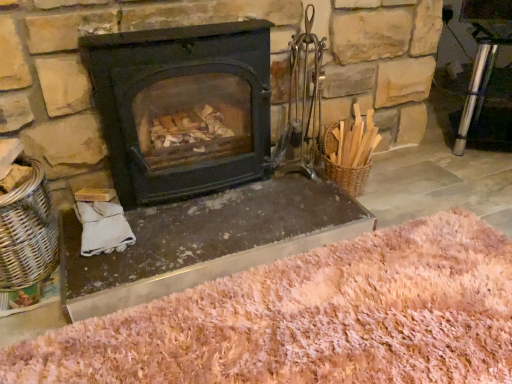
The image size is (512, 384). What are the coordinates of `free point below matte black wood burning stove at center (from a real-world perspective)` in the screenshot? It's located at (197, 198).